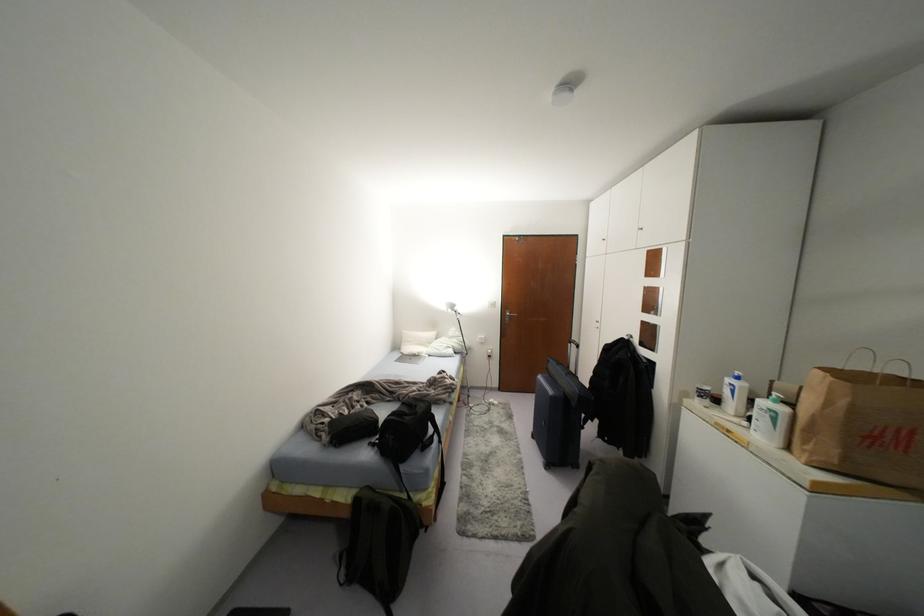
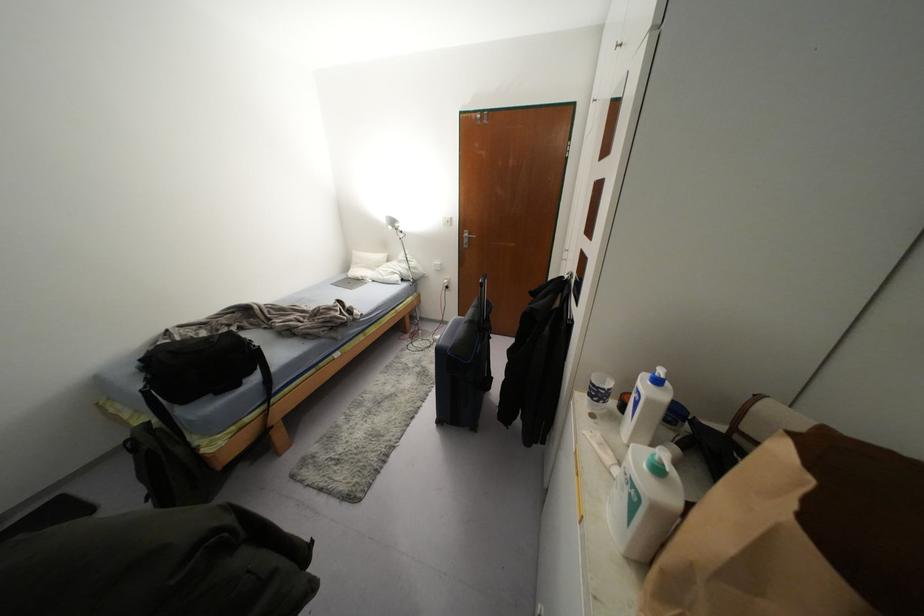
Locate, in the second image, the point that corresponds to point (699, 395) in the first image.

(590, 395)